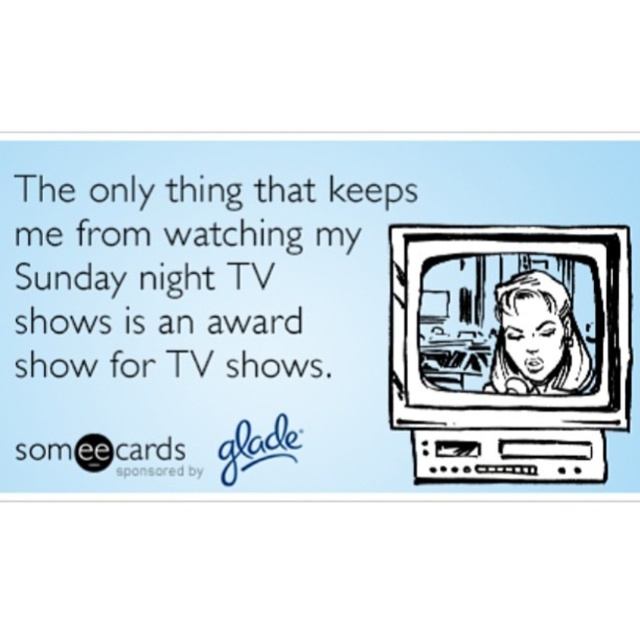
Who is lower down, black ink drawing of a woman at center or smooth black hair at center?

smooth black hair at center

Is point (390, 321) positioned before point (520, 323)?

No.

At what (x,y) coordinates should I click in order to perform the action: click on black ink drawing of a woman at center. Please return your answer as a coordinate pair (x, y). Looking at the image, I should click on (512, 326).